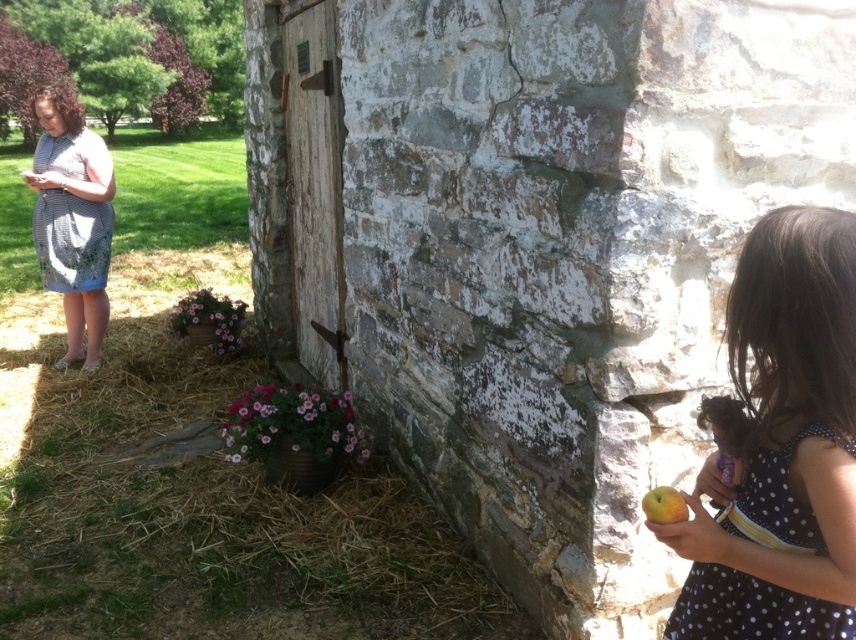
Question: Which of the following is the closest to the observer?

Choices:
 (A) striped fabric dress at left
 (B) yellow matte apple at lower right

Answer: (B)

Question: Does brown straw at lower left appear over striped fabric dress at left?

Choices:
 (A) yes
 (B) no

Answer: (B)

Question: Is polka dot dress at right behind striped fabric dress at left?

Choices:
 (A) no
 (B) yes

Answer: (A)

Question: Which of the following is the farthest from the observer?

Choices:
 (A) yellow matte apple at lower right
 (B) polka dot dress at right

Answer: (A)

Question: Is brown straw at lower left above yellow matte apple at lower right?

Choices:
 (A) yes
 (B) no

Answer: (B)

Question: Which point is farther to the camera?

Choices:
 (A) (94, 310)
 (B) (474, 596)

Answer: (A)